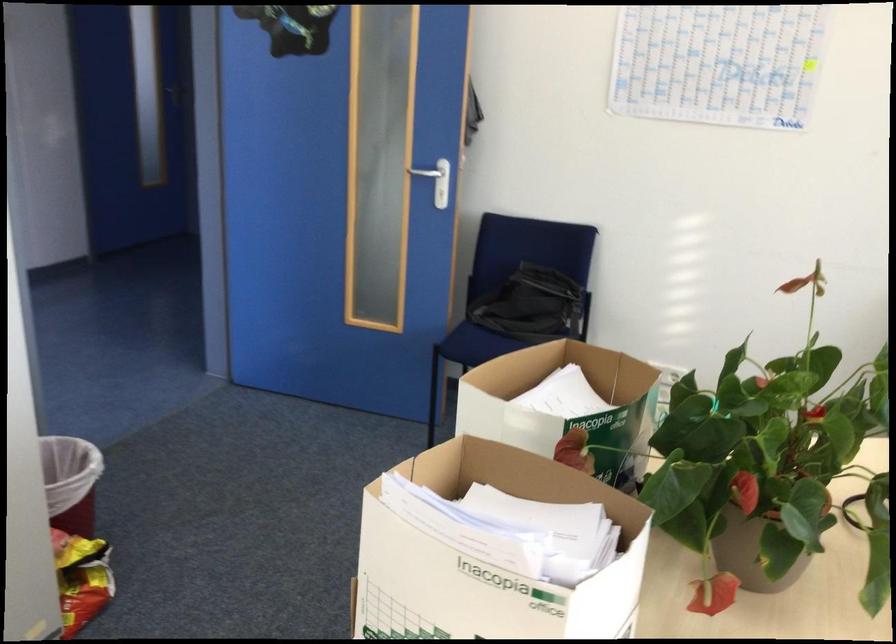
Which object does [752,553] point to?

It corresponds to the brown flower pot in the image.